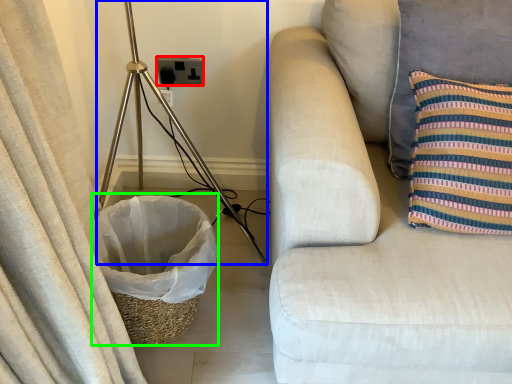
Question: Based on their relative distances, which object is farther from electric outlet (highlighted by a red box)? Choose from tripod (highlighted by a blue box) and laundry basket (highlighted by a green box).

Choices:
 (A) tripod
 (B) laundry basket

Answer: (B)